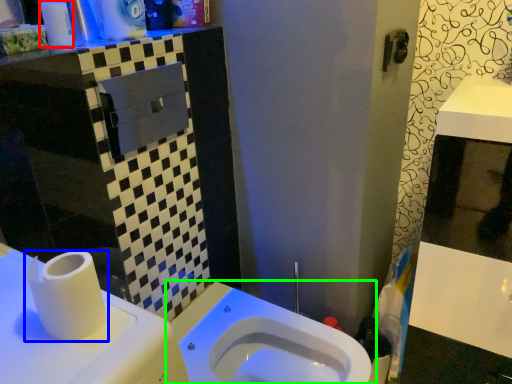
Question: Which object is positioned closest to toiletry (highlighted by a red box)? Select from toilet paper (highlighted by a blue box) and toilet (highlighted by a green box).

Choices:
 (A) toilet paper
 (B) toilet

Answer: (A)